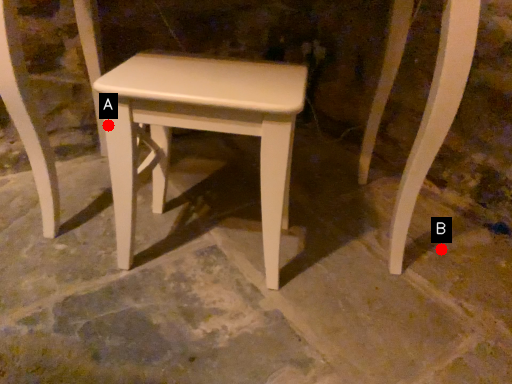
Question: Two points are circled on the image, labeled by A and B beside each circle. Which point appears closest to the camera in this image?

Choices:
 (A) A is closer
 (B) B is closer

Answer: (A)